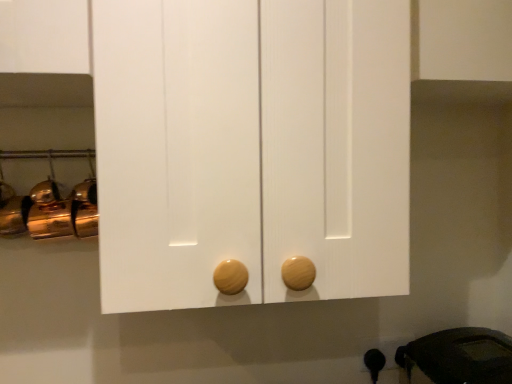
Question: From a real-world perspective, relative to wooden at bottom, is black rubber kettle at lower right vertically above or below?

Choices:
 (A) below
 (B) above

Answer: (B)

Question: Looking at their shapes, would you say black rubber kettle at lower right is wider or thinner than wooden at bottom?

Choices:
 (A) thin
 (B) wide

Answer: (B)

Question: In terms of height, does black rubber kettle at lower right look taller or shorter compared to wooden at bottom?

Choices:
 (A) tall
 (B) short

Answer: (A)

Question: Based on their positions, is wooden at bottom located to the left or right of black rubber kettle at lower right?

Choices:
 (A) left
 (B) right

Answer: (A)

Question: From a real-world perspective, relative to black rubber kettle at lower right, is wooden at bottom vertically above or below?

Choices:
 (A) below
 (B) above

Answer: (A)

Question: From the image's perspective, is wooden at bottom located above or below black rubber kettle at lower right?

Choices:
 (A) below
 (B) above

Answer: (A)

Question: Does point (373, 382) appear closer or farther from the camera than point (417, 369)?

Choices:
 (A) farther
 (B) closer

Answer: (B)